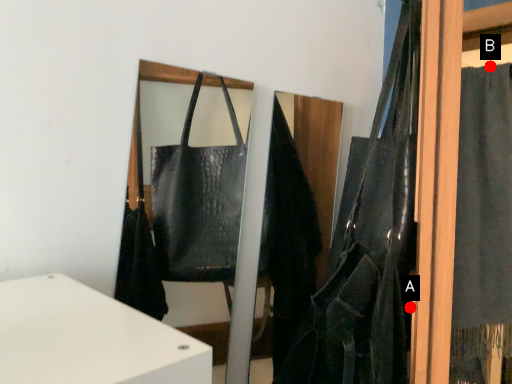
Question: Two points are circled on the image, labeled by A and B beside each circle. Among these points, which one is nearest to the camera?

Choices:
 (A) A is closer
 (B) B is closer

Answer: (A)